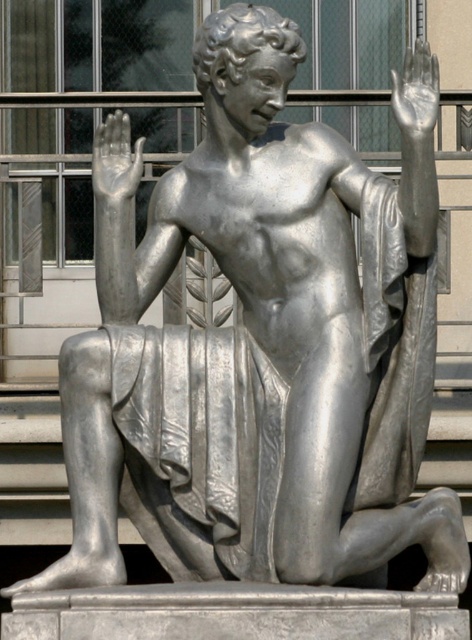
Question: Which point is closer to the camera?

Choices:
 (A) silver metallic hand at upper left
 (B) metallic silver hand at upper right

Answer: (B)

Question: Does silver metallic hand at upper left have a lesser width compared to metallic silver hand at upper right?

Choices:
 (A) yes
 (B) no

Answer: (A)

Question: Is silver metallic hand at upper left bigger than metallic silver hand at upper right?

Choices:
 (A) yes
 (B) no

Answer: (B)

Question: Does silver metallic hand at upper left appear on the right side of metallic silver hand at upper right?

Choices:
 (A) no
 (B) yes

Answer: (A)

Question: Among these points, which one is nearest to the camera?

Choices:
 (A) (415, 132)
 (B) (123, 180)

Answer: (A)

Question: Which point appears closest to the camera in this image?

Choices:
 (A) (406, 96)
 (B) (121, 180)

Answer: (A)